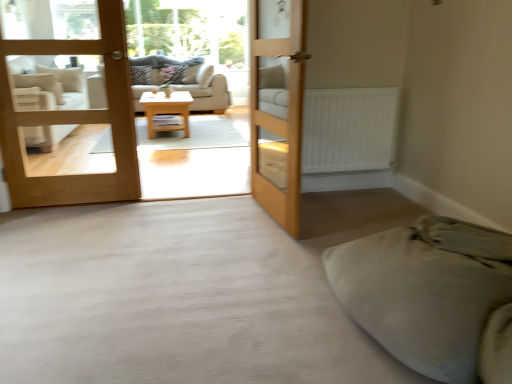
What do you see at coordinates (278, 108) in the screenshot?
I see `light brown wooden door at center, the second door from the left` at bounding box center [278, 108].

What do you see at coordinates (432, 296) in the screenshot?
I see `soft beige blanket at lower right` at bounding box center [432, 296].

Locate an element on the screen. white fabric armchair at left is located at coordinates (47, 87).

In order to face light brown wood door at left, the first door from the left, should I rotate leftwards or rightwards?

Turn left approximately 24.395 degrees to face it.

This screenshot has width=512, height=384. I want to click on light brown wood door at left, the first door from the left, so click(x=75, y=122).

In order to face patterned fabric pillow at center, arranged as the 1th pillow when viewed from the right, should I rotate leftwards or rightwards?

Rotate your view left by about 10.862°.

I want to click on light wood/texture coffee table at center, so click(x=167, y=111).

What do you see at coordinates (188, 29) in the screenshot? This screenshot has width=512, height=384. I see `transparent glass window screen at upper center` at bounding box center [188, 29].

At what (x,y) coordinates should I click in order to perform the action: click on transparent glass window screen at upper center. Please return your answer as a coordinate pair (x, y). This screenshot has width=512, height=384. Looking at the image, I should click on tap(188, 29).

Where is `light brown wooden door at center, the second door from the left`? This screenshot has height=384, width=512. light brown wooden door at center, the second door from the left is located at coordinates (278, 108).

Does point (172, 80) come farther from viewer compared to point (141, 83)?

Yes.

Is patterned fabric pillow at center, which is the second pillow in left-to-right order, next to patterned fabric pillow at center, the second pillow in the right-to-left sequence?

There is a gap between patterned fabric pillow at center, which is the second pillow in left-to-right order, and patterned fabric pillow at center, the second pillow in the right-to-left sequence.

Is patterned fabric pillow at center, the first pillow in the left-to-right sequence, located within patterned fabric pillow at center, which is the second pillow in left-to-right order?

No, patterned fabric pillow at center, the first pillow in the left-to-right sequence, is located outside of patterned fabric pillow at center, which is the second pillow in left-to-right order.

Is the surface of white matte radiator at center in direct contact with white fabric armchair at left?

white matte radiator at center and white fabric armchair at left are clearly separated.

Can you confirm if white matte radiator at center is bigger than white fabric armchair at left?

Incorrect, white matte radiator at center is not larger than white fabric armchair at left.

Is white matte radiator at center positioned beyond the bounds of white fabric armchair at left?

Yes, white matte radiator at center is outside of white fabric armchair at left.

Which object is further away from the camera, white matte radiator at center or white fabric armchair at left?

white fabric armchair at left is further away from the camera.

Who is shorter, wooden bunk bed at center or transparent glass window screen at upper center?

Standing shorter between the two is transparent glass window screen at upper center.

In the image, is wooden bunk bed at center positioned in front of or behind transparent glass window screen at upper center?

Clearly, wooden bunk bed at center is in front of transparent glass window screen at upper center.

The height and width of the screenshot is (384, 512). In order to click on bunk bed in front of the transparent glass window screen at upper center in this screenshot , I will do `click(74, 120)`.

Which of these two, wooden bunk bed at center or transparent glass window screen at upper center, is wider?

Wider between the two is transparent glass window screen at upper center.

From a real-world perspective, which is physically above, patterned fabric pillow at center, which is the second pillow in left-to-right order, or light brown wood door at left, the first door from the left?

light brown wood door at left, the first door from the left, from a real-world perspective.

Is patterned fabric pillow at center, which is the second pillow in left-to-right order, outside of light brown wood door at left, the first door from the left?

Yes, patterned fabric pillow at center, which is the second pillow in left-to-right order, is not within light brown wood door at left, the first door from the left.

This screenshot has height=384, width=512. I want to click on the 1st door in front of the patterned fabric pillow at center, which is the second pillow in left-to-right order, so click(75, 122).

How different are the orientations of patterned fabric pillow at center, arranged as the 1th pillow when viewed from the right, and light brown wood door at left, the first door from the left, in degrees?

They differ by 0.000109 degrees in their facing directions.

Who is smaller, white matte radiator at center or wooden bunk bed at center?

white matte radiator at center is smaller.

From a real-world perspective, between white matte radiator at center and wooden bunk bed at center, who is vertically higher?

wooden bunk bed at center is physically above.

Is wooden bunk bed at center completely or partially inside white matte radiator at center?

Actually, wooden bunk bed at center is outside white matte radiator at center.

Does point (376, 93) appear closer or farther from the camera than point (291, 138)?

Point (376, 93).

Does point (129, 132) appear closer or farther from the camera than point (134, 67)?

Point (129, 132) is closer to the camera than point (134, 67).

Consider the image. Which object is thinner, wooden bunk bed at center or patterned fabric pillow at center, the second pillow in the right-to-left sequence?

wooden bunk bed at center is thinner.

From a real-world perspective, who is located higher, wooden bunk bed at center or patterned fabric pillow at center, the second pillow in the right-to-left sequence?

From a 3D spatial view, wooden bunk bed at center is above.

Is wooden bunk bed at center aimed at patterned fabric pillow at center, the first pillow in the left-to-right sequence?

No.

Is soft beige blanket at lower right completely or partially inside white matte radiator at center?

Definitely not — soft beige blanket at lower right is not inside white matte radiator at center.

From a real-world perspective, does white matte radiator at center sit lower than soft beige blanket at lower right?

Actually, white matte radiator at center is physically above soft beige blanket at lower right in the real world.

From the image's perspective, is white matte radiator at center below soft beige blanket at lower right?

No, from the image's perspective, white matte radiator at center is not beneath soft beige blanket at lower right.

Considering their positions, is white matte radiator at center located in front of or behind soft beige blanket at lower right?

Clearly, white matte radiator at center is behind soft beige blanket at lower right.

Locate an element on the screen. The image size is (512, 384). pillow behind the patterned fabric pillow at center, the second pillow in the right-to-left sequence is located at coordinates (173, 73).

Locate an element on the screen. This screenshot has height=384, width=512. armchair that appears below the white matte radiator at center (from a real-world perspective) is located at coordinates (47, 87).

Based on the photo, from the image, which object appears to be farther from transparent glass window screen at upper center, wooden bunk bed at center or patterned fabric pillow at center, arranged as the 1th pillow when viewed from the right?

Among the two, wooden bunk bed at center is located further to transparent glass window screen at upper center.

From the image, which object appears to be farther from white fabric armchair at left, light brown wooden door at center, the first door viewed from the right, or patterned fabric pillow at center, which is the second pillow in left-to-right order?

light brown wooden door at center, the first door viewed from the right, is positioned further to the anchor white fabric armchair at left.

Considering their positions, is white fabric armchair at left positioned closer to patterned fabric pillow at center, the first pillow in the left-to-right sequence, than light brown wood door at left, the first door from the left?

white fabric armchair at left is positioned closer to the anchor patterned fabric pillow at center, the first pillow in the left-to-right sequence.

Based on the photo, based on their spatial positions, is soft beige blanket at lower right or beige fabric couch at center closer to patterned fabric pillow at center, arranged as the 1th pillow when viewed from the right?

beige fabric couch at center lies closer to patterned fabric pillow at center, arranged as the 1th pillow when viewed from the right, than the other object.

Looking at the image, which one is located further to light brown wooden door at center, the second door from the left, soft beige blanket at lower right or white fabric armchair at left?

Among the two, white fabric armchair at left is located further to light brown wooden door at center, the second door from the left.

From the image, which object appears to be farther from light brown wood door at left, the first door from the left, white fabric armchair at left or patterned fabric pillow at center, arranged as the 1th pillow when viewed from the right?

patterned fabric pillow at center, arranged as the 1th pillow when viewed from the right.

Considering their positions, is light brown wooden door at center, the first door viewed from the right, positioned further to beige fabric couch at center than patterned fabric pillow at center, which is the second pillow in left-to-right order?

light brown wooden door at center, the first door viewed from the right, is positioned further to the anchor beige fabric couch at center.

When comparing their distances from beige fabric couch at center, does white fabric armchair at left or soft beige blanket at lower right seem further?

Among the two, soft beige blanket at lower right is located further to beige fabric couch at center.

Locate an element on the screen. The image size is (512, 384). door between light brown wooden door at center, the first door viewed from the right, and patterned fabric pillow at center, arranged as the 1th pillow when viewed from the right, from front to back is located at coordinates point(75,122).

Find the location of `radiator between light brown wooden door at center, the second door from the left, and patterned fabric pillow at center, which is the second pillow in left-to-right order, along the z-axis`. radiator between light brown wooden door at center, the second door from the left, and patterned fabric pillow at center, which is the second pillow in left-to-right order, along the z-axis is located at coordinates (348, 129).

What are the coordinates of `armchair located between wooden bunk bed at center and transparent glass window screen at upper center in the depth direction` in the screenshot? It's located at (47, 87).

I want to click on table between white matte radiator at center and patterned fabric pillow at center, which is the second pillow in left-to-right order, in the front-back direction, so click(167, 111).